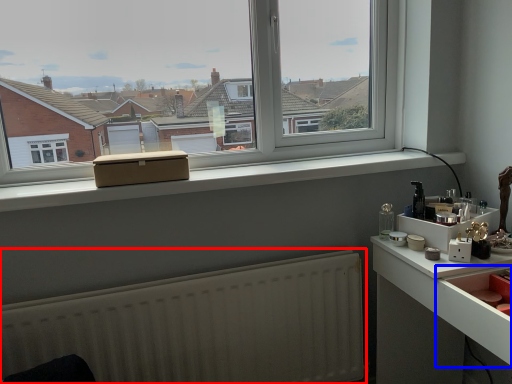
Question: Which object appears closest to the camera in this image, radiator (highlighted by a red box) or drawer (highlighted by a blue box)?

Choices:
 (A) radiator
 (B) drawer

Answer: (B)